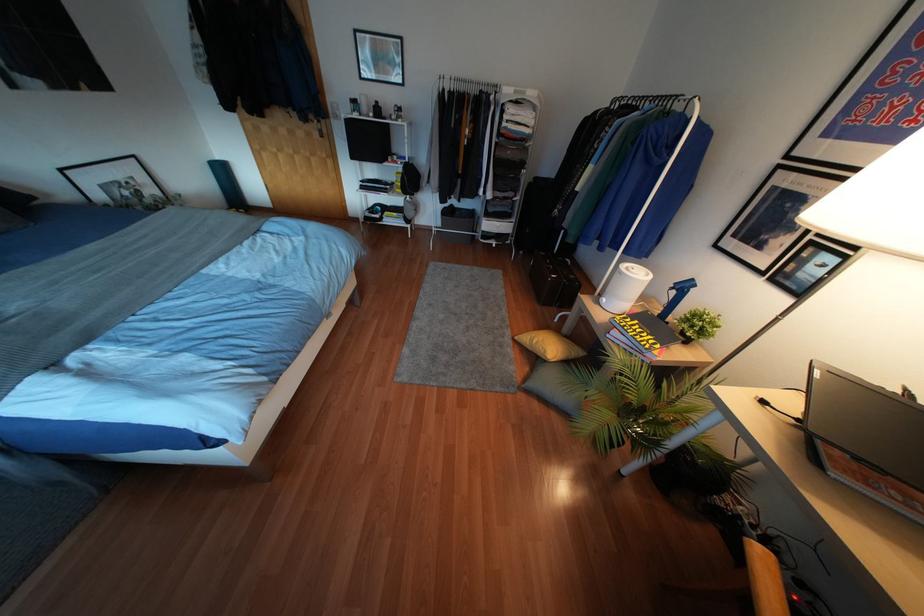
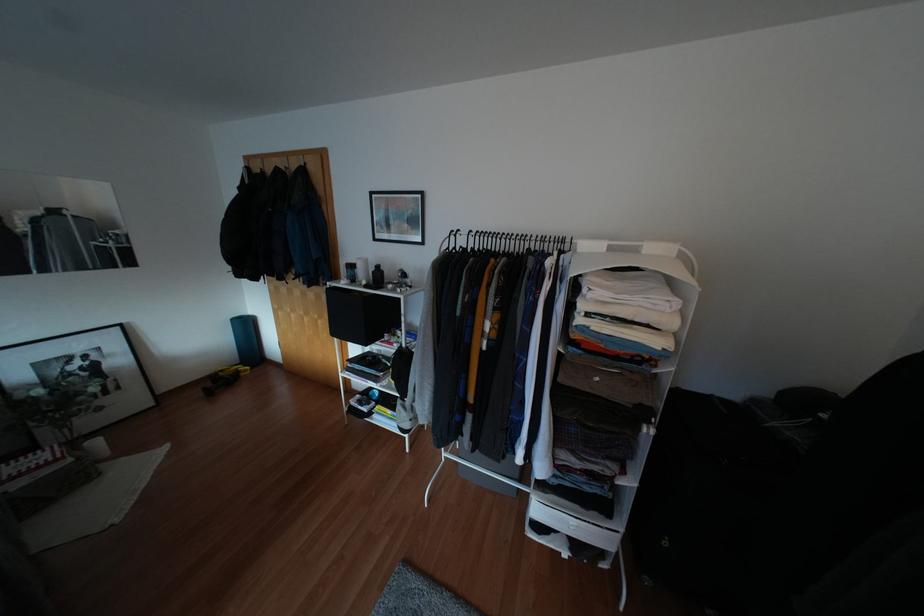
In the second image, find the point that corresponds to (487,84) in the first image.

(542, 238)